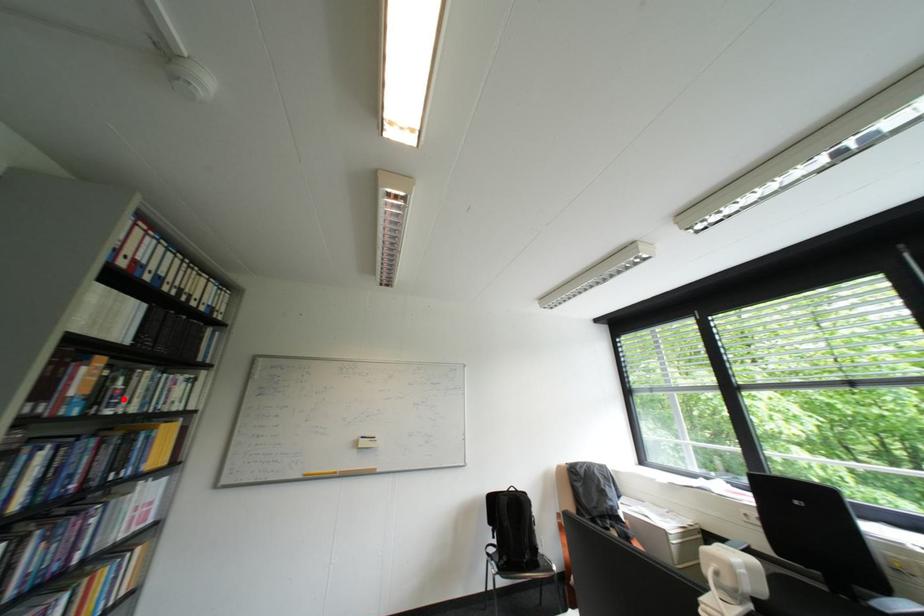
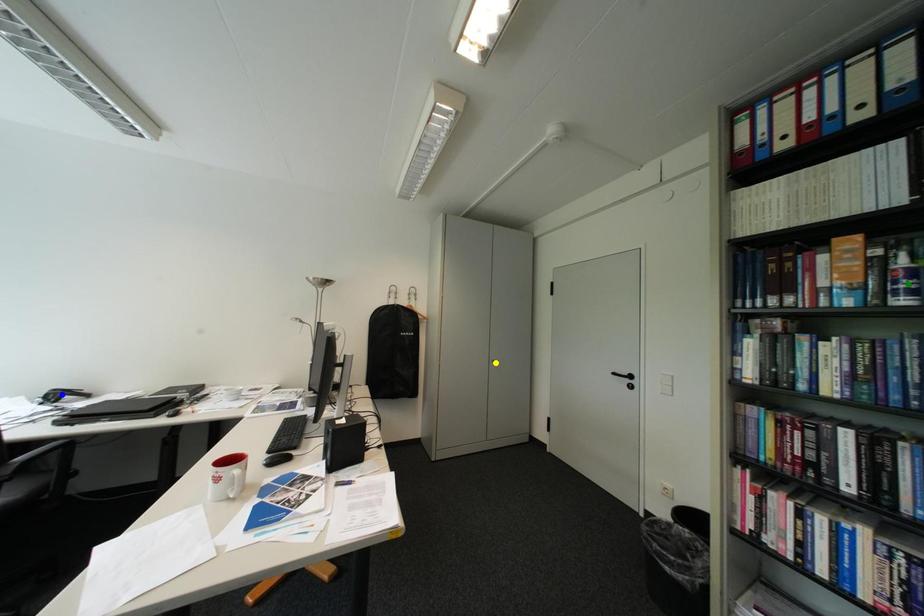
Question: I am providing you with two images of the same scene from different viewpoints. A red point is marked on the first image. You are given multiple points on the second image. Which spot in image 2 lines up with the point in image 1?

Choices:
 (A) blue point
 (B) green point
 (C) yellow point

Answer: (B)